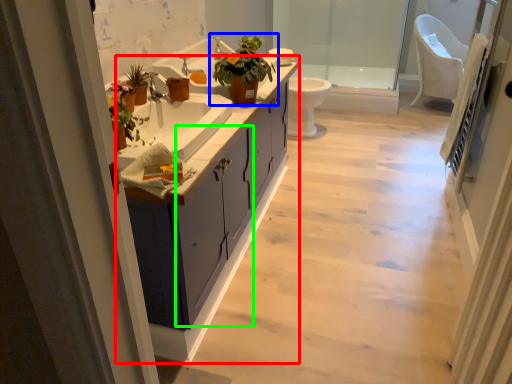
Question: Considering the real-world distances, which object is farthest from bathroom cabinet (highlighted by a red box)? houseplant (highlighted by a blue box) or cabinetry (highlighted by a green box)?

Choices:
 (A) houseplant
 (B) cabinetry

Answer: (A)